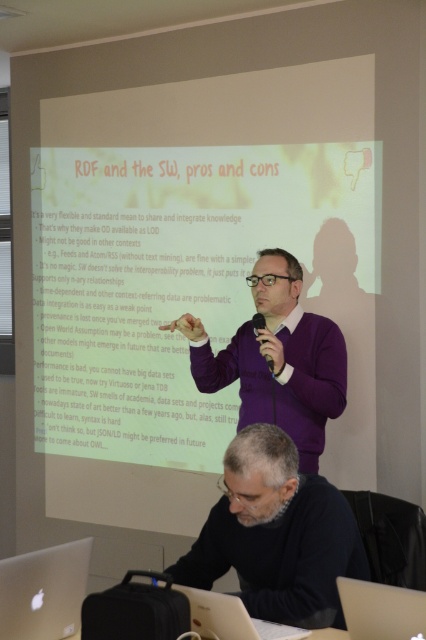
Question: Is silver metallic laptop at lower left above matte white table at lower center?

Choices:
 (A) no
 (B) yes

Answer: (B)

Question: Which of the following is the closest to the observer?

Choices:
 (A) matte white table at lower center
 (B) gray sweater at lower center

Answer: (A)

Question: Which object is closer to the camera taking this photo?

Choices:
 (A) purple sweater at center
 (B) silver metallic laptop at lower right
 (C) gray sweater at lower center
 (D) white matte projection screen at upper center

Answer: (B)

Question: Is gray sweater at lower center positioned behind silver metallic laptop at lower center?

Choices:
 (A) no
 (B) yes

Answer: (B)

Question: Is gray sweater at lower center bigger than purple sweater at center?

Choices:
 (A) no
 (B) yes

Answer: (A)

Question: Which object is positioned closest to the silver metallic laptop at lower right?

Choices:
 (A) gray sweater at lower center
 (B) silver metallic laptop at lower center
 (C) matte white table at lower center
 (D) silver metallic laptop at lower left

Answer: (B)